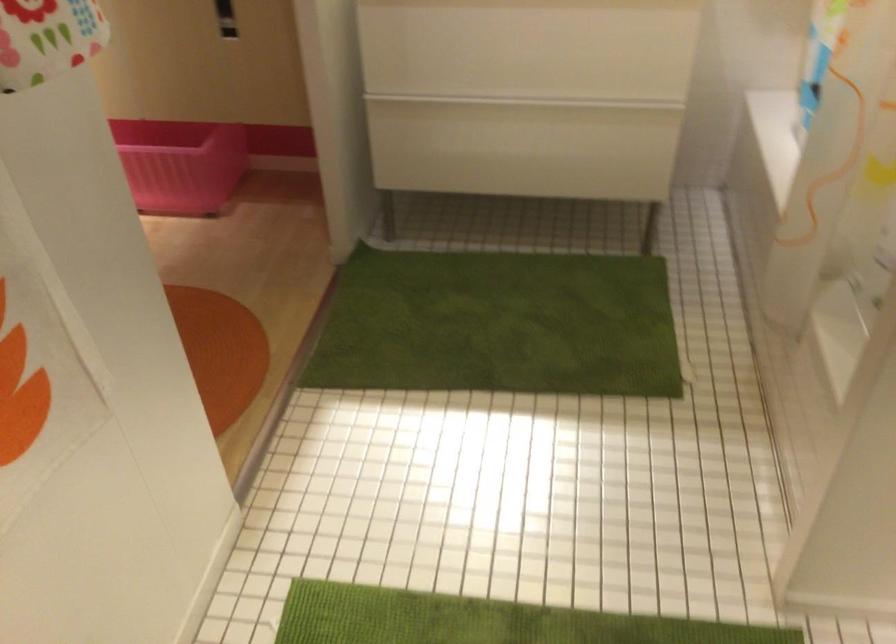
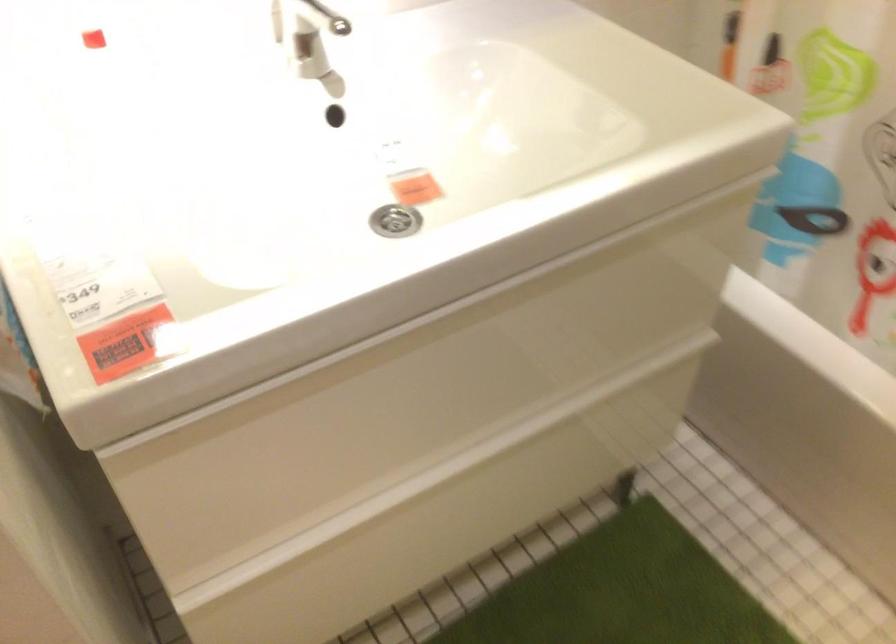
The point at (x=494, y=131) is marked in the first image. Where is the corresponding point in the second image?

(442, 514)